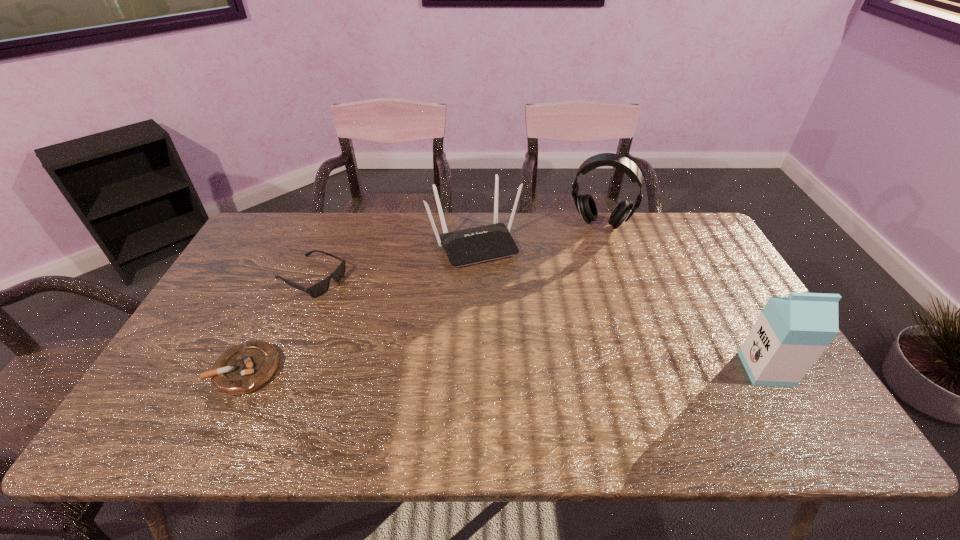
Find the location of a particular element. vacant point located on the front-facing side of the third shortest object is located at coordinates (513, 314).

The width and height of the screenshot is (960, 540). Find the location of `free spot located on the ear cups of the second object from right to left`. free spot located on the ear cups of the second object from right to left is located at coordinates (586, 260).

The height and width of the screenshot is (540, 960). Find the location of `free space located on the ear cups of the second object from right to left`. free space located on the ear cups of the second object from right to left is located at coordinates (580, 280).

You are a GUI agent. You are given a task and a screenshot of the screen. Output one action in this format:
    pyautogui.click(x=<x>, y=<y>)
    Task: Click on the vacant point located on the ear cups of the second object from right to left
    The width and height of the screenshot is (960, 540).
    Given the screenshot: What is the action you would take?
    pyautogui.click(x=579, y=282)

Find the location of a particular element. Image resolution: width=960 pixels, height=540 pixels. vacant position located 0.160m on the front-facing side of the sunglasses is located at coordinates (379, 309).

Identify the location of vacant space situated on the front-facing side of the sunglasses. This screenshot has width=960, height=540. (451, 343).

At what (x,y) coordinates should I click in order to perform the action: click on free space located 0.130m on the front-facing side of the sunglasses. Please return your answer as a coordinate pair (x, y). Image resolution: width=960 pixels, height=540 pixels. Looking at the image, I should click on [371, 306].

This screenshot has width=960, height=540. Find the location of `router positioned at the far edge`. router positioned at the far edge is located at coordinates (480, 244).

At what (x,y) coordinates should I click in order to perform the action: click on earphone that is at the far edge. Please return your answer as a coordinate pair (x, y). Looking at the image, I should click on (585, 204).

This screenshot has height=540, width=960. Find the location of `ashtray that is positioned at the near edge`. ashtray that is positioned at the near edge is located at coordinates (244, 368).